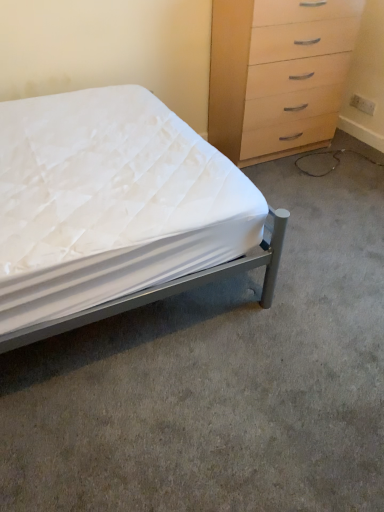
Question: Is white fabric bed at lower left placed right next to metallic gray bed at left?

Choices:
 (A) yes
 (B) no

Answer: (B)

Question: Is white fabric bed at lower left facing towards metallic gray bed at left?

Choices:
 (A) no
 (B) yes

Answer: (A)

Question: Is white fabric bed at lower left not close to metallic gray bed at left?

Choices:
 (A) yes
 (B) no

Answer: (B)

Question: Does white fabric bed at lower left come in front of metallic gray bed at left?

Choices:
 (A) no
 (B) yes

Answer: (A)

Question: Is white fabric bed at lower left bigger than metallic gray bed at left?

Choices:
 (A) no
 (B) yes

Answer: (A)

Question: Does white fabric bed at lower left have a smaller size compared to metallic gray bed at left?

Choices:
 (A) yes
 (B) no

Answer: (A)

Question: From a real-world perspective, does white fabric bed at lower left sit lower than light wood/wooden chest of drawers at upper right?

Choices:
 (A) no
 (B) yes

Answer: (B)

Question: Can you confirm if white fabric bed at lower left is taller than light wood/wooden chest of drawers at upper right?

Choices:
 (A) no
 (B) yes

Answer: (A)

Question: Does white fabric bed at lower left appear on the left side of light wood/wooden chest of drawers at upper right?

Choices:
 (A) no
 (B) yes

Answer: (B)

Question: Is white fabric bed at lower left to the right of light wood/wooden chest of drawers at upper right from the viewer's perspective?

Choices:
 (A) yes
 (B) no

Answer: (B)

Question: Is white fabric bed at lower left shorter than light wood/wooden chest of drawers at upper right?

Choices:
 (A) yes
 (B) no

Answer: (A)

Question: Is the depth of white fabric bed at lower left less than that of light wood/wooden chest of drawers at upper right?

Choices:
 (A) no
 (B) yes

Answer: (B)

Question: Is metallic gray bed at left at the back of light wood/wooden chest of drawers at upper right?

Choices:
 (A) yes
 (B) no

Answer: (B)